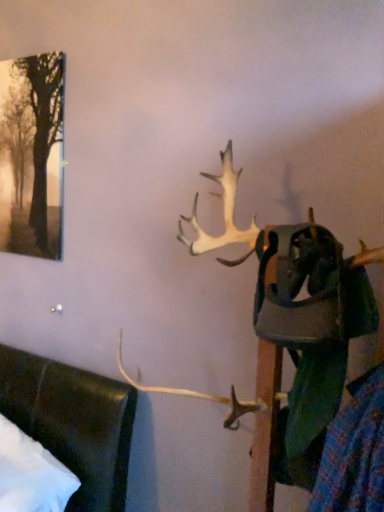
Question: Does white antler at upper center lie behind silvery metallic tree at upper left?

Choices:
 (A) no
 (B) yes

Answer: (A)

Question: Can you confirm if white antler at upper center is taller than silvery metallic tree at upper left?

Choices:
 (A) yes
 (B) no

Answer: (A)

Question: From the image's perspective, would you say white antler at upper center is shown under silvery metallic tree at upper left?

Choices:
 (A) yes
 (B) no

Answer: (A)

Question: Is white antler at upper center placed right next to silvery metallic tree at upper left?

Choices:
 (A) no
 (B) yes

Answer: (A)

Question: From a real-world perspective, is white antler at upper center over silvery metallic tree at upper left?

Choices:
 (A) yes
 (B) no

Answer: (B)

Question: Is white antler at upper center surrounding silvery metallic tree at upper left?

Choices:
 (A) yes
 (B) no

Answer: (B)

Question: Can you confirm if silvery metallic tree at upper left is bigger than white antler at upper center?

Choices:
 (A) yes
 (B) no

Answer: (B)

Question: Would you say silvery metallic tree at upper left is a long distance from white antler at upper center?

Choices:
 (A) no
 (B) yes

Answer: (B)

Question: Considering the relative sizes of silvery metallic tree at upper left and white antler at upper center in the image provided, is silvery metallic tree at upper left wider than white antler at upper center?

Choices:
 (A) no
 (B) yes

Answer: (A)

Question: From the image's perspective, would you say silvery metallic tree at upper left is shown under white antler at upper center?

Choices:
 (A) no
 (B) yes

Answer: (A)

Question: Is silvery metallic tree at upper left oriented towards white antler at upper center?

Choices:
 (A) no
 (B) yes

Answer: (A)

Question: Is silvery metallic tree at upper left further to camera compared to white antler at upper center?

Choices:
 (A) no
 (B) yes

Answer: (B)

Question: Is silvery metallic tree at upper left wider or thinner than white antler at upper center?

Choices:
 (A) thin
 (B) wide

Answer: (A)